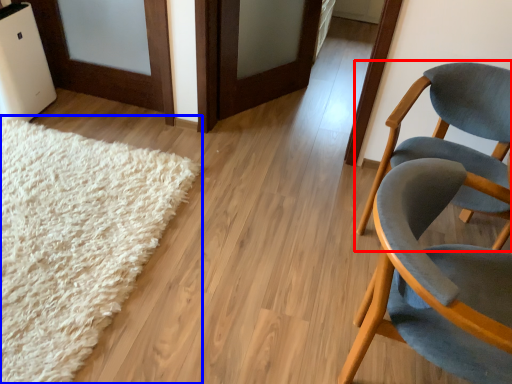
Question: Which point is closer to the camera, chair (highlighted by a red box) or mat (highlighted by a blue box)?

Choices:
 (A) chair
 (B) mat

Answer: (B)